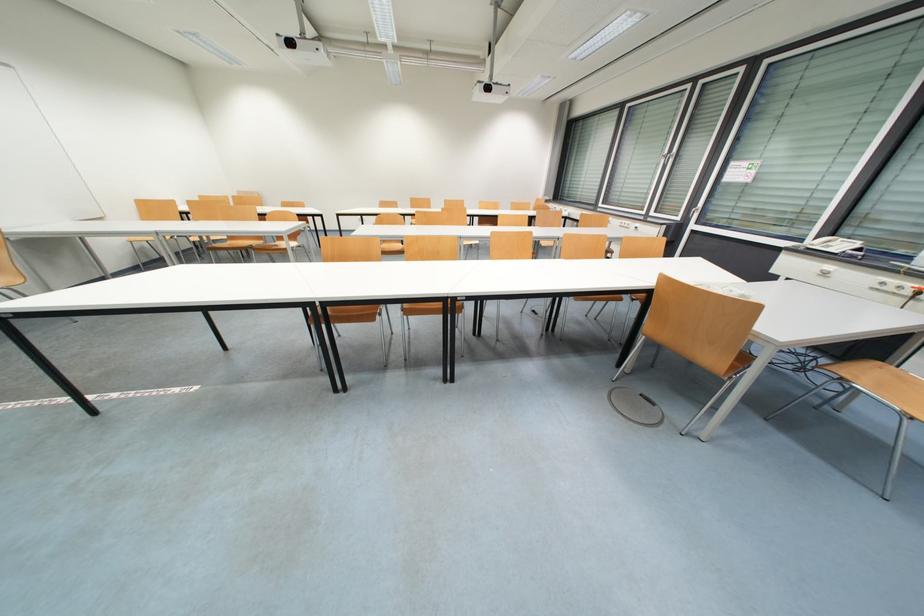
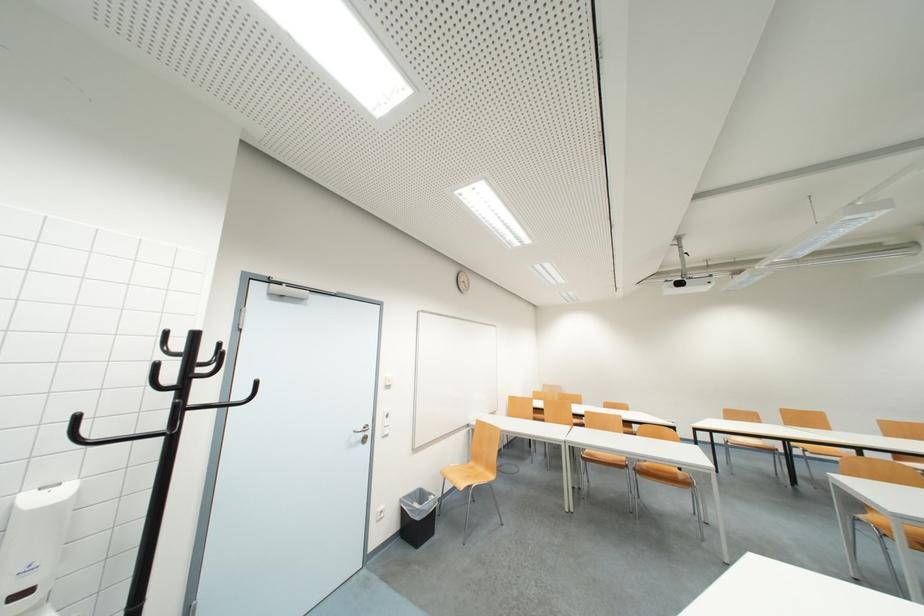
The point at (388, 207) is marked in the first image. Where is the corresponding point in the second image?

(736, 416)